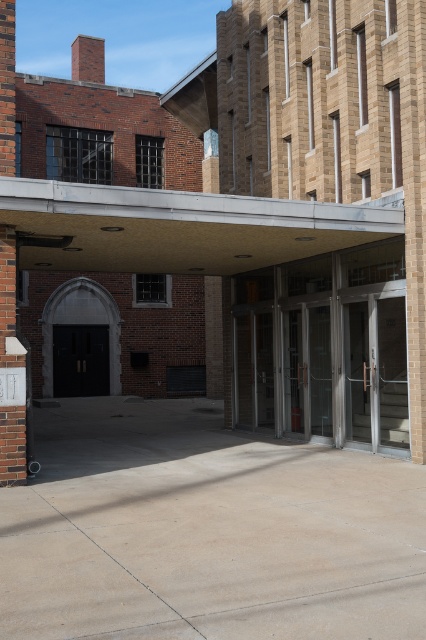
You are standing in the architectural scene and want to place a small decorative plant between the two points, point (x=14, y=474) and point (x=66, y=381). Which point should the plant be closer to if you want it to appear larger in the image?

The plant should be placed closer to point (x=14, y=474) because it is closer to the viewer, making objects placed there appear larger in the image compared to those further away like point (x=66, y=381).

You are an architect analyzing the spatial layout of the building. Given that the brick pillar at left and the black matte door at center are both in the foreground, which object takes up more visual space in the image?

The black matte door at center occupies more visual space than the brick pillar at left because the brick pillar at left occupies less space than black matte door at center.